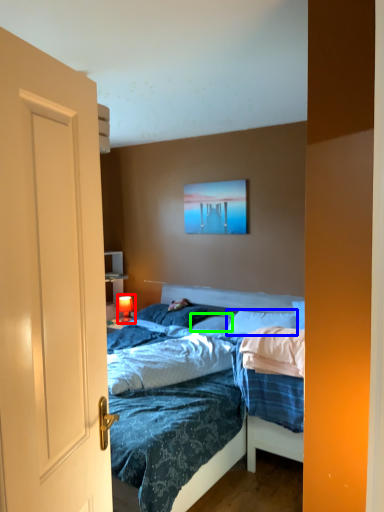
Question: Based on their relative distances, which object is nearer to lamp (highlighted by a red box)? Choose from pillow (highlighted by a blue box) and pillow (highlighted by a green box).

Choices:
 (A) pillow
 (B) pillow

Answer: (B)